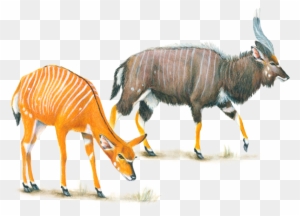
Identify the location of grey and white checkerboard pattern. The width and height of the screenshot is (300, 216). (232, 204), (252, 205).